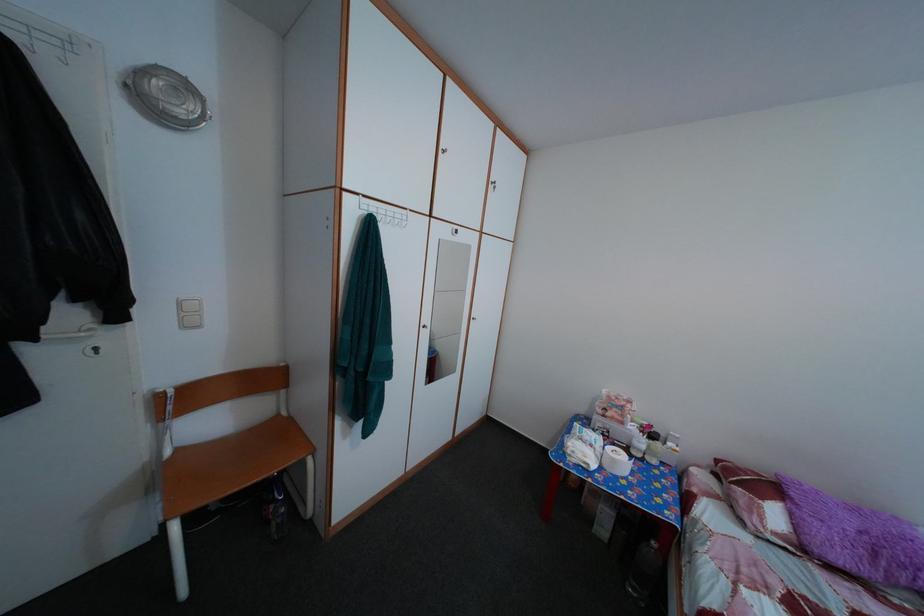
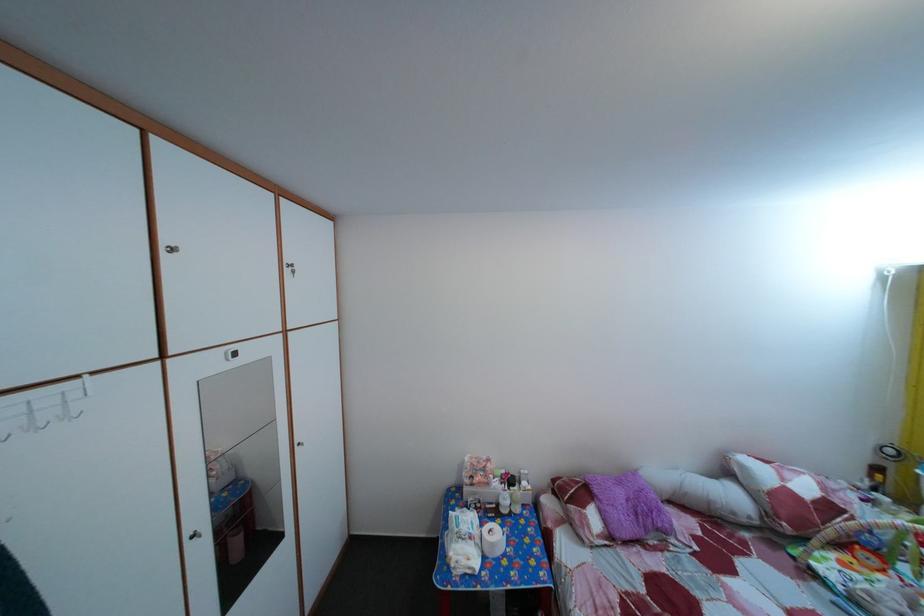
Where in the second image is the point corresponding to (667,442) from the first image?

(524, 485)